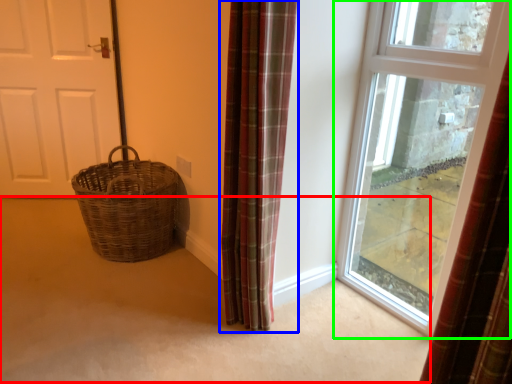
Question: Based on their relative distances, which object is farther from corridor (highlighted by a red box)? Choose from curtain (highlighted by a blue box) and window (highlighted by a green box).

Choices:
 (A) curtain
 (B) window

Answer: (B)